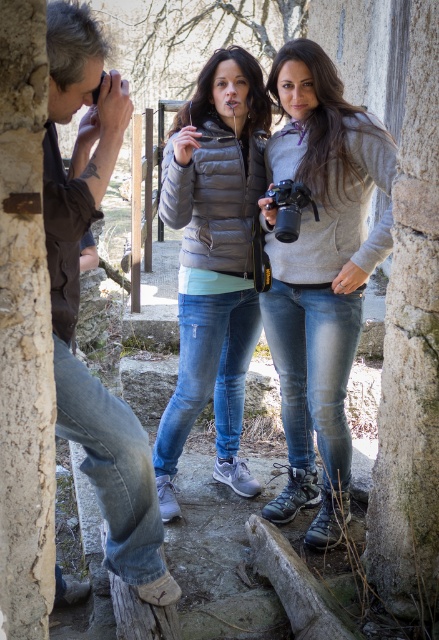
Who is more forward, (75, 320) or (287, 189)?

Positioned in front is point (75, 320).

Can you confirm if brown leather jacket at left is thinner than black plastic camera at center?

In fact, brown leather jacket at left might be wider than black plastic camera at center.

Is point (63, 120) behind point (284, 189)?

No, it is in front of (284, 189).

Locate an element on the screen. This screenshot has height=640, width=439. brown leather jacket at left is located at coordinates (78, 300).

Which of these two, gray fleece jacket at center or black plastic camera at center, stands shorter?

Standing shorter between the two is black plastic camera at center.

Can you confirm if gray fleece jacket at center is positioned to the left of black plastic camera at center?

In fact, gray fleece jacket at center is to the right of black plastic camera at center.

Where is `gray fleece jacket at center`? gray fleece jacket at center is located at coordinates (320, 275).

Does matte gray puffer jacket at center have a larger size compared to brown leather jacket at left?

Indeed, matte gray puffer jacket at center has a larger size compared to brown leather jacket at left.

Is matte gray puffer jacket at center to the left of brown leather jacket at left from the viewer's perspective?

No, matte gray puffer jacket at center is not to the left of brown leather jacket at left.

Image resolution: width=439 pixels, height=640 pixels. I want to click on matte gray puffer jacket at center, so click(213, 260).